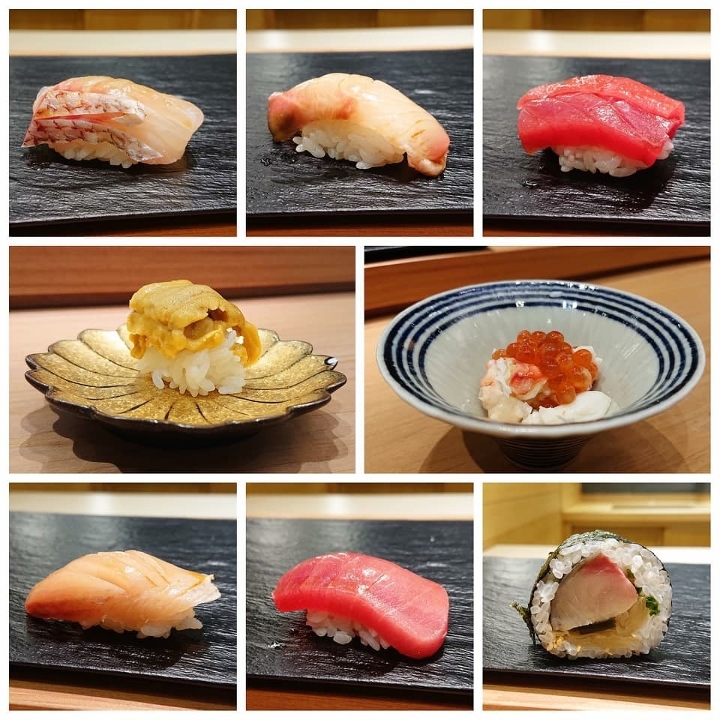
What are the coordinates of `white border between pictures` in the screenshot? It's located at (238, 142), (474, 117), (364, 237), (355, 302), (309, 480), (232, 561), (477, 569).